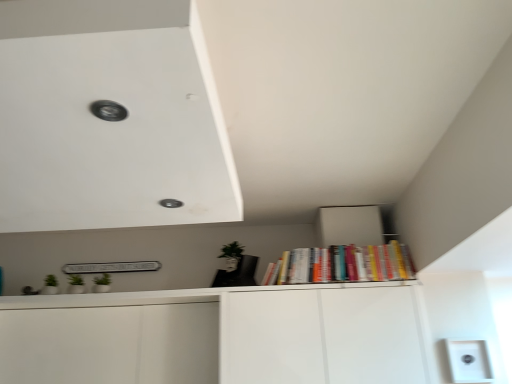
Question: Looking at the image, does white plastic light switch at lower right seem bigger or smaller compared to hardcover books at upper right?

Choices:
 (A) big
 (B) small

Answer: (B)

Question: Considering their positions, is white plastic light switch at lower right located in front of or behind hardcover books at upper right?

Choices:
 (A) front
 (B) behind

Answer: (A)

Question: From their relative heights in the image, would you say white plastic light switch at lower right is taller or shorter than hardcover books at upper right?

Choices:
 (A) tall
 (B) short

Answer: (B)

Question: Looking at their shapes, would you say hardcover books at upper right is wider or thinner than white plastic light switch at lower right?

Choices:
 (A) wide
 (B) thin

Answer: (A)

Question: Is hardcover books at upper right to the left or to the right of white plastic light switch at lower right in the image?

Choices:
 (A) left
 (B) right

Answer: (A)

Question: In the image, is hardcover books at upper right positioned in front of or behind white plastic light switch at lower right?

Choices:
 (A) behind
 (B) front

Answer: (A)

Question: Which is correct: hardcover books at upper right is inside white plastic light switch at lower right, or outside of it?

Choices:
 (A) outside
 (B) inside

Answer: (A)